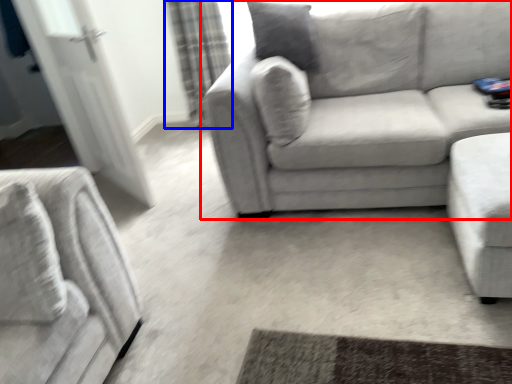
Question: Which object appears farthest to the camera in this image, studio couch (highlighted by a red box) or curtain (highlighted by a blue box)?

Choices:
 (A) studio couch
 (B) curtain

Answer: (B)